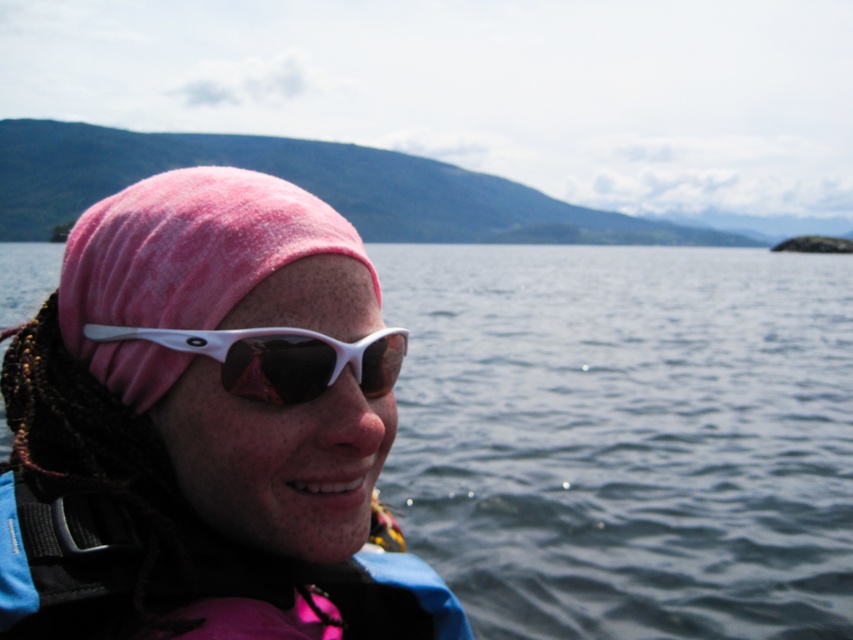
The height and width of the screenshot is (640, 853). What do you see at coordinates (206, 426) in the screenshot? I see `pink fleece beanie at upper left` at bounding box center [206, 426].

Who is more distant from viewer, (380, 376) or (201, 573)?

Point (380, 376)

Locate an element on the screen. This screenshot has height=640, width=853. pink fleece beanie at upper left is located at coordinates (206, 426).

Does blue fabric life jacket at lower left appear under white matte sunglasses at center?

Yes, blue fabric life jacket at lower left is below white matte sunglasses at center.

What do you see at coordinates (190, 577) in the screenshot? The image size is (853, 640). I see `blue fabric life jacket at lower left` at bounding box center [190, 577].

Where is `blue fabric life jacket at lower left`? Image resolution: width=853 pixels, height=640 pixels. blue fabric life jacket at lower left is located at coordinates (190, 577).

Is pink fleece beanie at upper left positioned in front of white matte sunglasses at center?

Yes.

How far apart are pink fleece beanie at upper left and white matte sunglasses at center?

pink fleece beanie at upper left and white matte sunglasses at center are 5.16 inches apart from each other.

Is point (144, 204) less distant than point (268, 388)?

No, (144, 204) is behind (268, 388).

The width and height of the screenshot is (853, 640). Find the location of `pink fleece beanie at upper left`. pink fleece beanie at upper left is located at coordinates (206, 426).